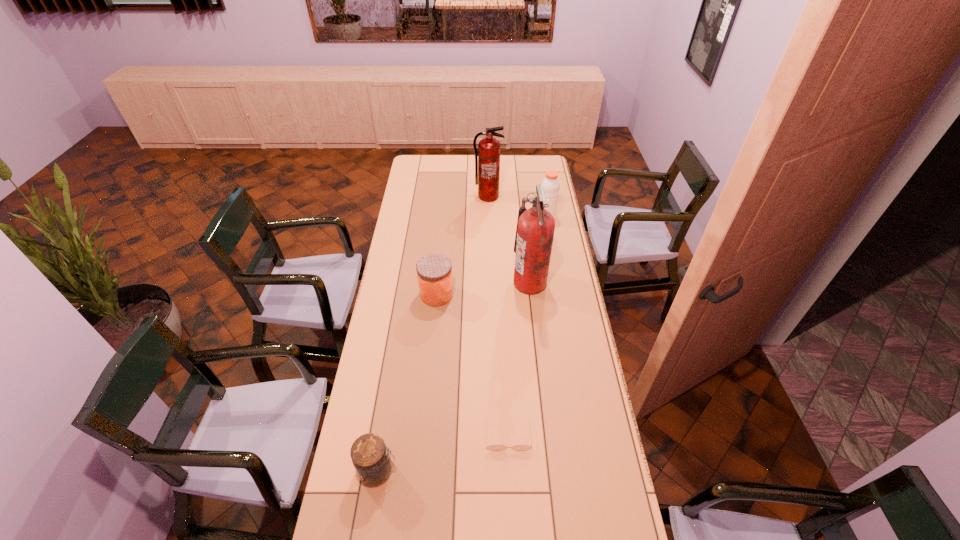
Locate an element on the screen. sunglasses is located at coordinates (492, 447).

I want to click on the second nearest object, so click(x=492, y=447).

Locate an element on the screen. vacant area located on the front of the right fire extinguisher near the operation label is located at coordinates (439, 283).

You are a GUI agent. You are given a task and a screenshot of the screen. Output one action in this format:
    pyautogui.click(x=<x>, y=<y>)
    Task: Click on the vacant space located on the front of the right fire extinguisher near the operation label
    
    Given the screenshot: What is the action you would take?
    pyautogui.click(x=474, y=283)

At what (x,y) coordinates should I click in order to perform the action: click on vacant space located on the front of the right fire extinguisher near the operation label. Please return your answer as a coordinate pair (x, y). Image resolution: width=960 pixels, height=540 pixels. Looking at the image, I should click on (479, 283).

Locate an element on the screen. vacant space located on the side of the left fire extinguisher with the handle and hose is located at coordinates (489, 222).

Find the location of a particular element. Image resolution: width=960 pixels, height=540 pixels. vacant region located on the front of the third tallest object is located at coordinates (553, 260).

The image size is (960, 540). In order to click on vacant region located 0.050m on the front of the right jar in this screenshot , I will do `click(435, 316)`.

Where is `free space located on the lid of the nearest object`? The height and width of the screenshot is (540, 960). free space located on the lid of the nearest object is located at coordinates (510, 470).

Where is `free space located 0.050m on the face of the second nearest object`? The width and height of the screenshot is (960, 540). free space located 0.050m on the face of the second nearest object is located at coordinates (510, 467).